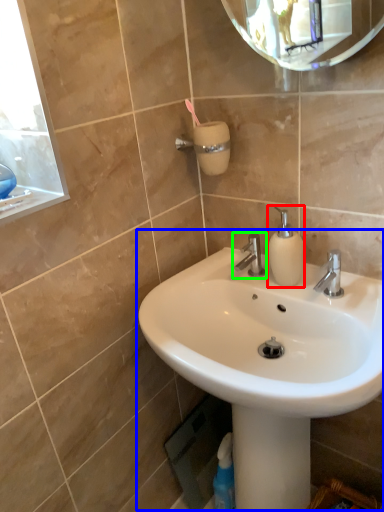
Question: Estimate the real-world distances between objects in this image. Which object is farther from soap dispenser (highlighted by a red box), sink (highlighted by a blue box) or tap (highlighted by a green box)?

Choices:
 (A) sink
 (B) tap

Answer: (A)